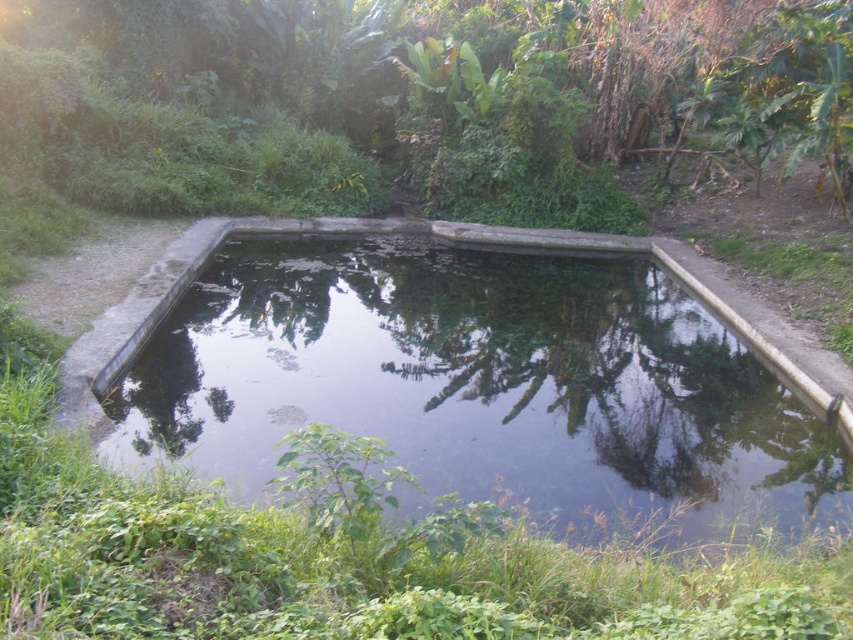
Question: Is green leafy tree at center in front of concrete pond at center?

Choices:
 (A) no
 (B) yes

Answer: (A)

Question: Can you confirm if green leafy tree at center is positioned to the right of concrete pond at center?

Choices:
 (A) yes
 (B) no

Answer: (B)

Question: Which point is closer to the camera?

Choices:
 (A) green leafy tree at center
 (B) concrete pond at center

Answer: (B)

Question: Does green leafy tree at center have a larger size compared to concrete pond at center?

Choices:
 (A) yes
 (B) no

Answer: (A)

Question: Among these objects, which one is farthest from the camera?

Choices:
 (A) green leafy tree at center
 (B) concrete pond at center

Answer: (A)

Question: Which point is farther to the camera?

Choices:
 (A) (602, 172)
 (B) (717, 397)

Answer: (A)